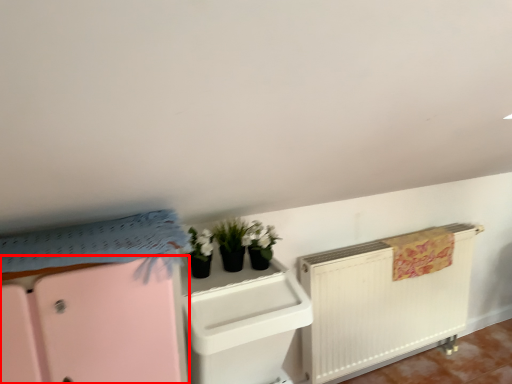
Question: In this image, where is file cabinet (annotated by the red box) located relative to file cabinet?

Choices:
 (A) right
 (B) left

Answer: (B)